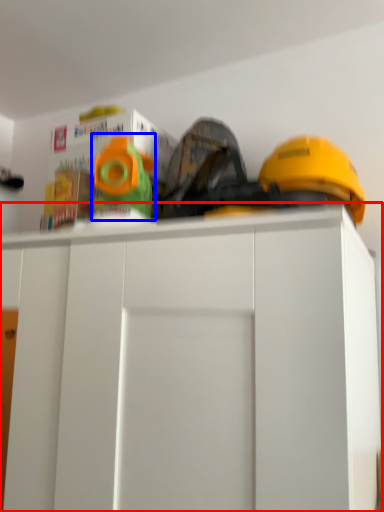
Question: Which object appears closest to the camera in this image, cabinetry (highlighted by a red box) or toy (highlighted by a blue box)?

Choices:
 (A) cabinetry
 (B) toy

Answer: (A)